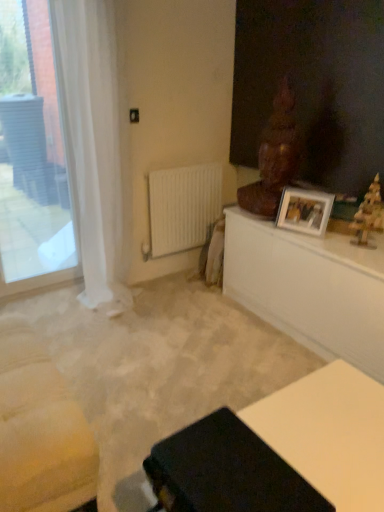
The image size is (384, 512). Find the location of `vacant region in front of transparent glass window at left`. vacant region in front of transparent glass window at left is located at coordinates (44, 312).